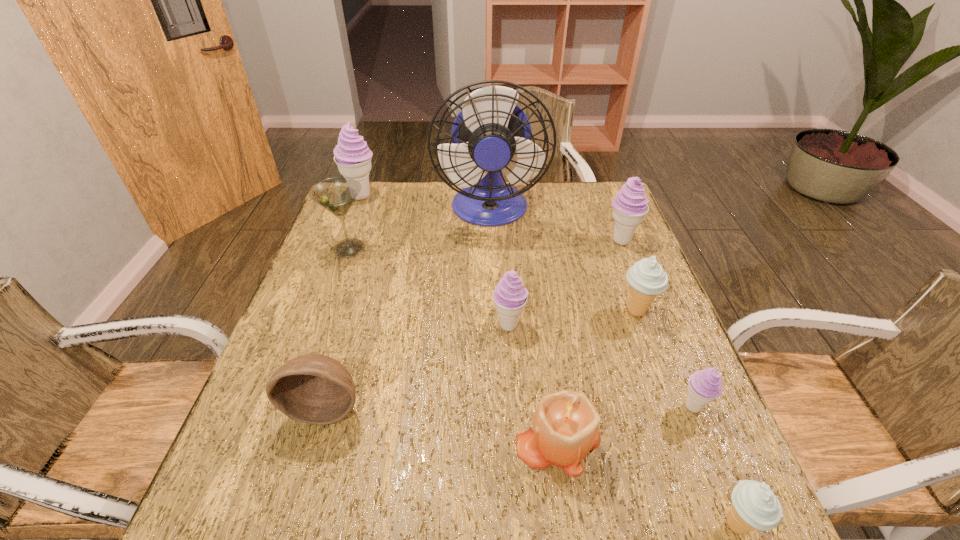
Locate an element on the screen. This screenshot has height=540, width=960. purple icecream that is the third nearest to the second smallest purple icecream is located at coordinates (353, 157).

Locate an element on the screen. The height and width of the screenshot is (540, 960). free spot that satisfies the following two spatial constraints: 1. on the front side of the martini; 2. on the right side of the candle is located at coordinates (281, 440).

Where is `free space that satisfies the following two spatial constraints: 1. on the back side of the nearest purple icecream; 2. on the left side of the bowl`? free space that satisfies the following two spatial constraints: 1. on the back side of the nearest purple icecream; 2. on the left side of the bowl is located at coordinates (326, 407).

The height and width of the screenshot is (540, 960). Identify the location of vacant region that satisfies the following two spatial constraints: 1. in front of the tallest object where the airflow is directed; 2. on the left side of the third purple icecream from right to left. (493, 325).